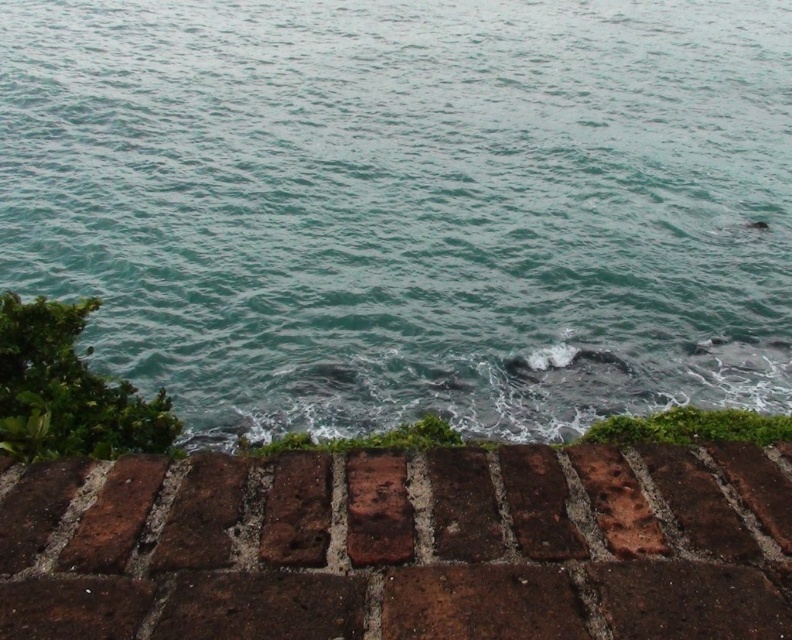
You are standing in front of the brick wall and want to throw a pebble into the teal water at center. Based on the coordinates provided, in which direction should you aim relative to the brick wall?

The teal water at center is located at coordinates point (408, 205), so you should aim towards the center of the scene relative to the brick wall.

You are standing on the beach looking at the scene. Which object is closer to you, the brown brick wall at lower center or the teal water at center?

The teal water at center is closer to you because the brown brick wall at lower center is behind it.

You are standing on the beach and see the brown brick wall at lower center and the teal water at center. Which object is higher in the image?

The teal water at center is higher in the image because it is positioned above the brown brick wall at lower center.